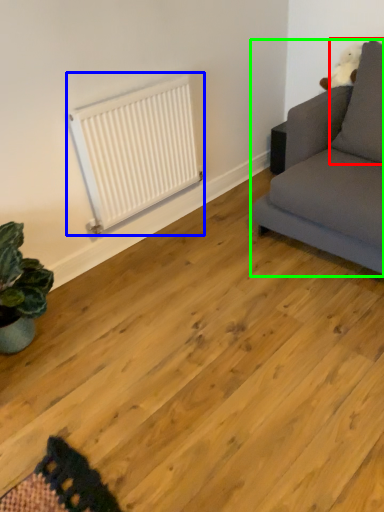
Question: Based on their relative distances, which object is nearer to pillow (highlighted by a red box)? Choose from radiator (highlighted by a blue box) and studio couch (highlighted by a green box).

Choices:
 (A) radiator
 (B) studio couch

Answer: (B)